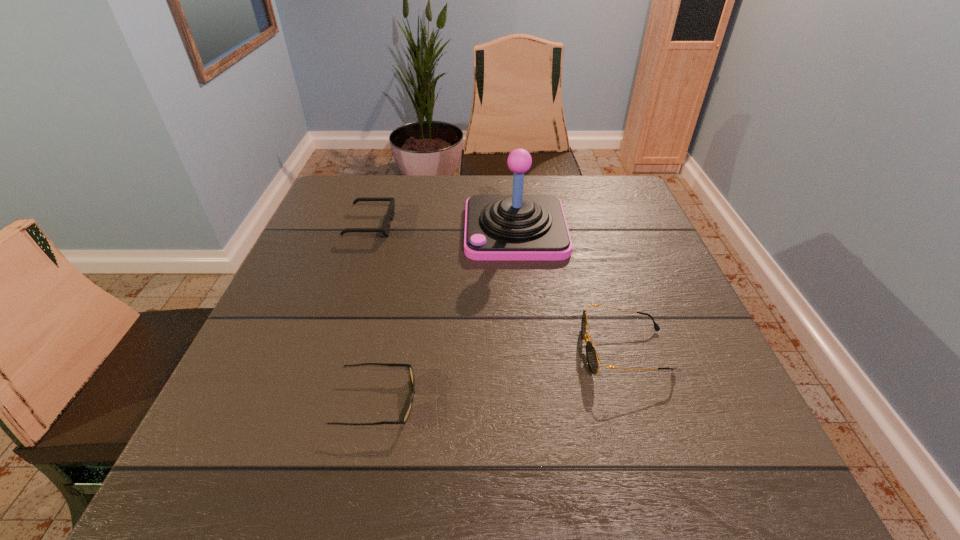
Find the location of a particular element. The height and width of the screenshot is (540, 960). vacant space at the far left corner is located at coordinates (363, 187).

What are the coordinates of `vacant space at the near right corner of the desktop` in the screenshot? It's located at (750, 448).

The image size is (960, 540). I want to click on vacant space in between the tallest object and the farthest sunglasses, so click(x=443, y=227).

Locate an element on the screen. free area in between the farthest sunglasses and the joystick is located at coordinates (443, 227).

This screenshot has width=960, height=540. Identify the location of vacant space in between the second tallest object and the joystick. (570, 290).

At what (x,y) coordinates should I click in order to perform the action: click on unoccupied position between the tallest sunglasses and the tallest object. Please return your answer as a coordinate pair (x, y). The height and width of the screenshot is (540, 960). Looking at the image, I should click on (570, 290).

At what (x,y) coordinates should I click in order to perform the action: click on vacant area that lies between the rightmost sunglasses and the farthest sunglasses. Please return your answer as a coordinate pair (x, y). The height and width of the screenshot is (540, 960). Looking at the image, I should click on (497, 288).

Locate which object ranks second in proximity to the farthest sunglasses. Please provide its 2D coordinates. Your answer should be formatted as a tuple, i.e. [(x, y)], where the tuple contains the x and y coordinates of a point satisfying the conditions above.

[(412, 378)]

Locate an element on the screen. the closest object relative to the second tallest object is located at coordinates (517, 227).

Point out which sunglasses is positioned as the second nearest to the tallest sunglasses. Please provide its 2D coordinates. Your answer should be formatted as a tuple, i.e. [(x, y)], where the tuple contains the x and y coordinates of a point satisfying the conditions above.

[(385, 230)]